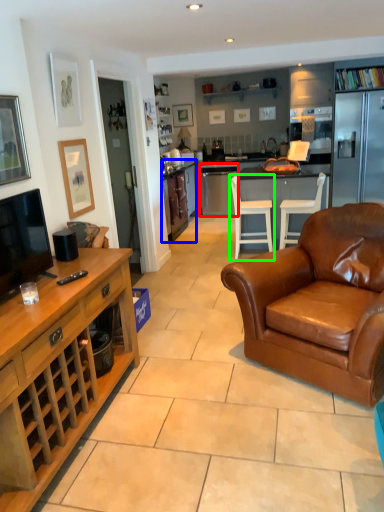
Question: Which is farther away from kitchen appliance (highlighted by a red box)? cabinetry (highlighted by a blue box) or chair (highlighted by a green box)?

Choices:
 (A) cabinetry
 (B) chair

Answer: (B)